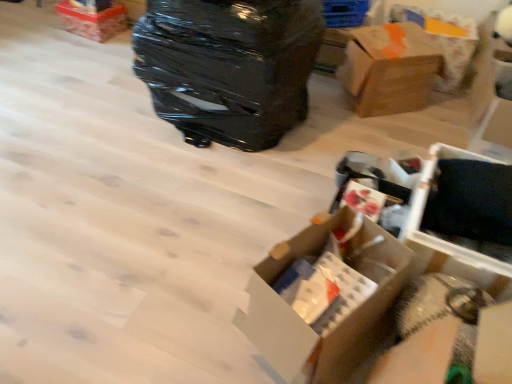
Question: From the image's perspective, is white cardboard box at center, which ranks as the third box in top-to-bottom order, on top of cardboard box at upper right?

Choices:
 (A) yes
 (B) no

Answer: (B)

Question: Is white cardboard box at center, which appears as the 1th box when viewed from the front, turned away from cardboard box at upper right?

Choices:
 (A) yes
 (B) no

Answer: (B)

Question: Is white cardboard box at center, the 2th box positioned from the right, surrounding cardboard box at upper right?

Choices:
 (A) yes
 (B) no

Answer: (B)

Question: Does white cardboard box at center, the 1th box in the bottom-to-top sequence, lie in front of cardboard box at upper right?

Choices:
 (A) yes
 (B) no

Answer: (A)

Question: Is white cardboard box at center, the second box positioned from the left, bigger than cardboard box at upper right?

Choices:
 (A) no
 (B) yes

Answer: (A)

Question: Considering the relative sizes of white cardboard box at center, which appears as the 1th box when viewed from the front, and cardboard box at upper right in the image provided, is white cardboard box at center, which appears as the 1th box when viewed from the front, shorter than cardboard box at upper right?

Choices:
 (A) no
 (B) yes

Answer: (A)

Question: Can you confirm if white plastic storage box at lower right, the first storage box in the front-to-back sequence, is shorter than brown cardboard box at upper right, the 2th box when ordered from top to bottom?

Choices:
 (A) no
 (B) yes

Answer: (B)

Question: Can brown cardboard box at upper right, positioned as the second box in bottom-to-top order, be found inside white plastic storage box at lower right, which is the second storage box in top-to-bottom order?

Choices:
 (A) no
 (B) yes

Answer: (A)

Question: Does white plastic storage box at lower right, placed as the first storage box when sorted from bottom to top, have a larger size compared to brown cardboard box at upper right, the third box when ordered from left to right?

Choices:
 (A) no
 (B) yes

Answer: (A)

Question: Could you tell me if white plastic storage box at lower right, which is the second storage box in top-to-bottom order, is facing brown cardboard box at upper right, positioned as the second box in front-to-back order?

Choices:
 (A) no
 (B) yes

Answer: (A)

Question: From the image's perspective, does white plastic storage box at lower right, placed as the 2th storage box when sorted from back to front, appear lower than brown cardboard box at upper right, the 1th box when ordered from right to left?

Choices:
 (A) yes
 (B) no

Answer: (A)

Question: Is white plastic storage box at lower right, which is the second storage box in top-to-bottom order, facing away from brown cardboard box at upper right, the 1th box when ordered from right to left?

Choices:
 (A) yes
 (B) no

Answer: (B)

Question: Is cardboard box at upper right thinner than white plastic storage box at lower right, the first storage box in the front-to-back sequence?

Choices:
 (A) no
 (B) yes

Answer: (A)